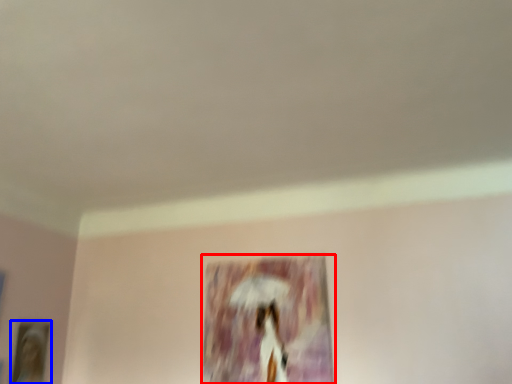
Question: Which point is closer to the camera, picture frame (highlighted by a red box) or picture frame (highlighted by a blue box)?

Choices:
 (A) picture frame
 (B) picture frame

Answer: (A)